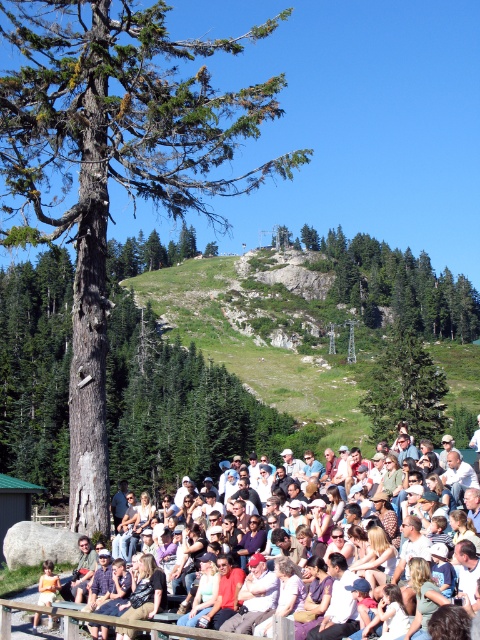
Is dark brown bark tree at left to the left of green matte tree at center from the viewer's perspective?

Indeed, dark brown bark tree at left is positioned on the left side of green matte tree at center.

Measure the distance between dark brown bark tree at left and green matte tree at center.

152.58 feet

Who is more forward, (x=220, y=188) or (x=418, y=349)?

Point (x=220, y=188) is more forward.

In order to click on dark brown bark tree at left in this screenshot , I will do `click(113, 164)`.

Is point (377, 305) closer to viewer compared to point (414, 355)?

No, it is behind (414, 355).

At what (x,y) coordinates should I click in order to perform the action: click on green textured rock at upper center. Please return your answer as a coordinate pair (x, y). This screenshot has height=640, width=480. Looking at the image, I should click on (396, 284).

Can you confirm if dark brown bark tree at left is positioned below light brown wooden bench at center?

No, dark brown bark tree at left is not below light brown wooden bench at center.

Does point (85, 381) come in front of point (276, 636)?

No, it is not.

At what (x,y) coordinates should I click in order to perform the action: click on dark brown bark tree at left. Please return your answer as a coordinate pair (x, y). Looking at the image, I should click on (113, 164).